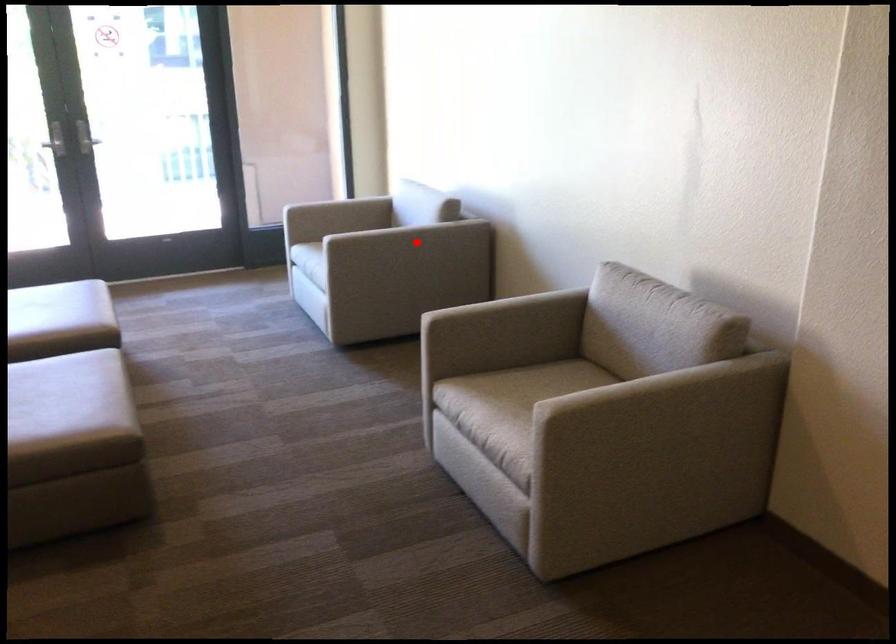
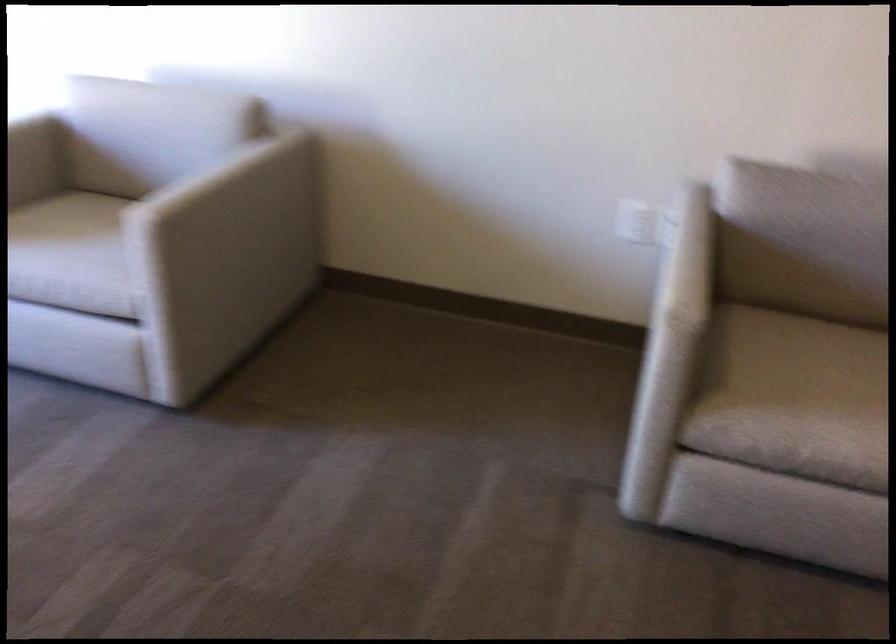
Question: I am providing you with two images of the same scene from different viewpoints. Given a red point in image1, look at the same physical point in image2. Is it:

Choices:
 (A) Closer to the viewpoint
 (B) Farther from the viewpoint

Answer: (A)